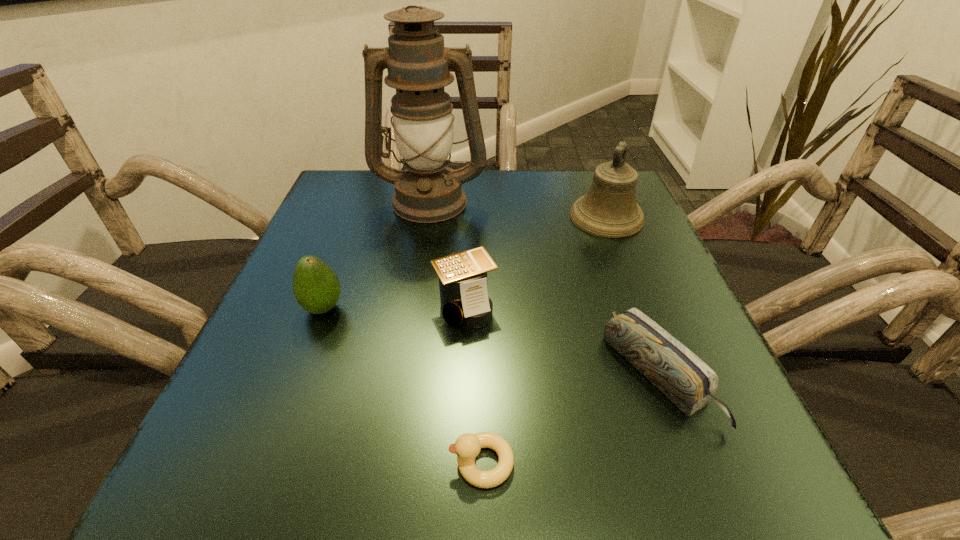
Locate an element on the screen. pencil box at the right edge is located at coordinates (688, 382).

Locate an element on the screen. Image resolution: width=960 pixels, height=540 pixels. object positioned at the far left corner is located at coordinates (418, 64).

Locate an element on the screen. The height and width of the screenshot is (540, 960). object positioned at the far right corner is located at coordinates (609, 209).

The image size is (960, 540). Identify the location of free space at the far edge. (503, 221).

Identify the location of vacant space at the left edge of the desktop. The height and width of the screenshot is (540, 960). point(262,362).

Find the location of `vacant space at the right edge`. vacant space at the right edge is located at coordinates (653, 389).

This screenshot has width=960, height=540. I want to click on vacant space at the far left corner, so click(334, 218).

The image size is (960, 540). In the image, there is a desktop. Identify the location of free region at the near left corner. (241, 441).

At what (x,y) coordinates should I click in order to perform the action: click on vacant space at the far right corner of the desktop. Please return your answer as a coordinate pair (x, y). Looking at the image, I should click on (563, 180).

At what (x,y) coordinates should I click in order to perform the action: click on vacant space that is in between the third tallest object and the pencil box. Please return your answer as a coordinate pair (x, y). Looking at the image, I should click on (491, 342).